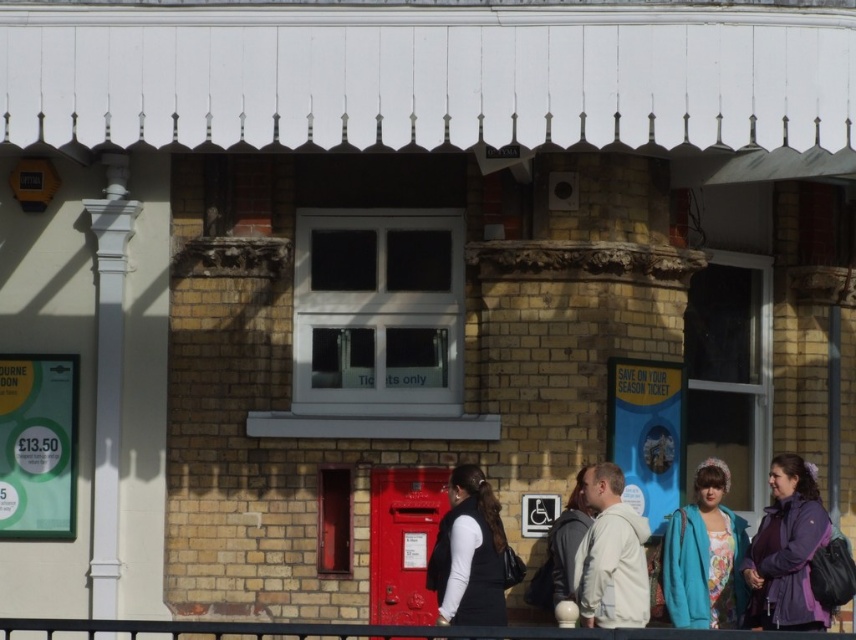
Question: Which point is closer to the camera taking this photo?

Choices:
 (A) (100, 557)
 (B) (4, 632)

Answer: (B)

Question: Is the position of white glossy column at left more distant than that of teal fleece jacket at lower right?

Choices:
 (A) yes
 (B) no

Answer: (A)

Question: Observing the image, what is the correct spatial positioning of teal fleece jacket at lower right in reference to gray hoodie at center?

Choices:
 (A) left
 (B) right

Answer: (B)

Question: Which object is the closest to the black matte vest at center?

Choices:
 (A) teal fleece jacket at lower right
 (B) gray hoodie at center
 (C) white fleece jacket at center

Answer: (B)

Question: Does white glossy column at left have a smaller size compared to metallic red rail at lower center?

Choices:
 (A) yes
 (B) no

Answer: (B)

Question: Among these points, which one is nearest to the camera?

Choices:
 (A) click(x=551, y=548)
 (B) click(x=708, y=548)
 (C) click(x=113, y=204)
 (D) click(x=776, y=499)

Answer: (A)